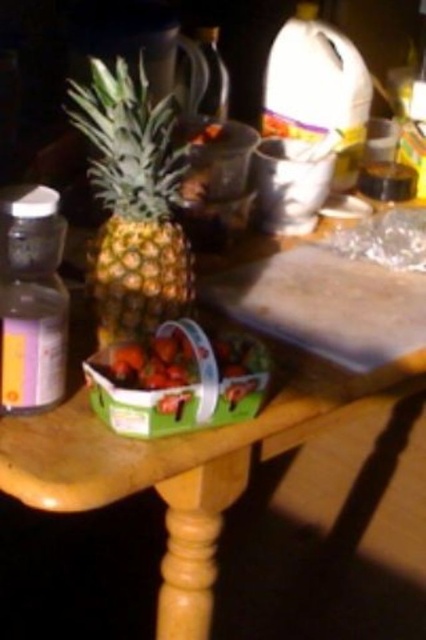
Between point (43, 460) and point (115, 177), which one is positioned behind?

The point (115, 177) is more distant.

Which is above, wooden table at center or green textured pineapple at center?

green textured pineapple at center is above.

Who is more distant from viewer, (408, 392) or (117, 193)?

Positioned behind is point (408, 392).

Where is `wooden table at center`? wooden table at center is located at coordinates (175, 467).